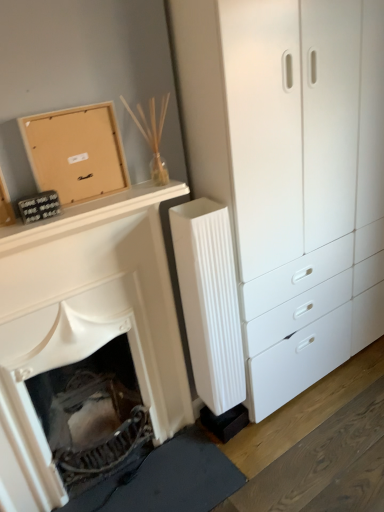
Find the location of a particular element. vacant space in front of matte brown cardboard at upper left is located at coordinates (66, 210).